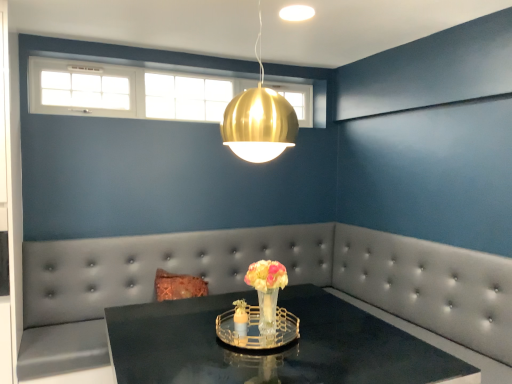
What is the approximate width of white glass window at upper center?

It is 11.47 centimeters.

The image size is (512, 384). I want to click on translucent glass vase at center, so click(x=267, y=290).

Is white glass window at upper center completely or partially inside gold metallic sphere at upper center?

No, white glass window at upper center is not inside gold metallic sphere at upper center.

From a real-world perspective, is gold metallic sphere at upper center positioned over white glass window at upper center based on gravity?

No, from a real-world perspective, gold metallic sphere at upper center is not on top of white glass window at upper center.

From the picture: From the image's perspective, which is above, gold metallic sphere at upper center or white glass window at upper center?

white glass window at upper center.

Which object is closer to the camera taking this photo, gold metallic sphere at upper center or white glass window at upper center?

gold metallic sphere at upper center is in front.

Does translucent glass vase at center have a greater width compared to tufted leather couch at center?

In fact, translucent glass vase at center might be narrower than tufted leather couch at center.

Is translucent glass vase at center facing towards tufted leather couch at center?

No, translucent glass vase at center is not turned towards tufted leather couch at center.

Which is nearer, (264, 296) or (99, 246)?

The point (264, 296) is more forward.

Is tufted leather couch at center wider than shiny black table at center?

No.

Which point is more distant from viewer, (428, 296) or (362, 325)?

The point (428, 296) is more distant.

Looking at the image, does tufted leather couch at center seem bigger or smaller compared to shiny black table at center?

Considering their sizes, tufted leather couch at center takes up less space than shiny black table at center.

Where is `table that is in front of the tufted leather couch at center`? table that is in front of the tufted leather couch at center is located at coordinates (272, 349).

Image resolution: width=512 pixels, height=384 pixels. Find the location of `lamp in front of the white glass window at upper center`. lamp in front of the white glass window at upper center is located at coordinates (259, 119).

From the image's perspective, is white glass window at upper center over gold metallic sphere at upper center?

Yes, from the image's perspective, white glass window at upper center is above gold metallic sphere at upper center.

Is white glass window at upper center in contact with gold metallic sphere at upper center?

white glass window at upper center and gold metallic sphere at upper center are not in contact.

Is white glass window at upper center closer to the viewer compared to gold metallic sphere at upper center?

No, it is behind gold metallic sphere at upper center.

From a real-world perspective, which object stands above the other?

gold metallic sphere at upper center.

What are the coordinates of `couch below the gold metallic sphere at upper center (from a real-world perspective)` in the screenshot? It's located at click(x=247, y=288).

Is tufted leather couch at center positioned with its back to gold metallic sphere at upper center?

That's not correct — tufted leather couch at center is not looking away from gold metallic sphere at upper center.

Is tufted leather couch at center bigger or smaller than gold metallic sphere at upper center?

tufted leather couch at center is bigger than gold metallic sphere at upper center.

Between translucent glass vase at center and white glass window at upper center, which one is positioned behind?

white glass window at upper center is more distant.

Between translucent glass vase at center and white glass window at upper center, which one appears on the left side from the viewer's perspective?

Positioned to the left is white glass window at upper center.

From the image's perspective, which is below, translucent glass vase at center or white glass window at upper center?

translucent glass vase at center.

Image resolution: width=512 pixels, height=384 pixels. In order to click on window that appears above the translucent glass vase at center (from a real-world perspective) in this screenshot , I will do `click(128, 91)`.

In the image, is white glass window at upper center on the left side or the right side of tufted leather couch at center?

In the image, white glass window at upper center appears on the left side of tufted leather couch at center.

Is white glass window at upper center positioned with its back to tufted leather couch at center?

white glass window at upper center does not have its back to tufted leather couch at center.

Consider the image. From the image's perspective, would you say white glass window at upper center is positioned over tufted leather couch at center?

Yes.

Would you say white glass window at upper center is a long distance from tufted leather couch at center?

Indeed, white glass window at upper center is not near tufted leather couch at center.

This screenshot has height=384, width=512. What are the coordinates of `window lying above the gold metallic sphere at upper center (from the image's perspective)` in the screenshot? It's located at click(128, 91).

You are a GUI agent. You are given a task and a screenshot of the screen. Output one action in this format:
    pyautogui.click(x=<x>, y=<y>)
    Task: Click on the floral arrangement on the right of tufted leather couch at center
    The height and width of the screenshot is (384, 512).
    Given the screenshot: What is the action you would take?
    pyautogui.click(x=267, y=290)

Based on the photo, when comparing their distances from gold metallic sphere at upper center, does tufted leather couch at center or white glass window at upper center seem further?

white glass window at upper center.

From the image, which object appears to be farther from white glass window at upper center, gold metallic sphere at upper center or shiny black table at center?

shiny black table at center lies further to white glass window at upper center than the other object.

Which object lies nearer to the anchor point white glass window at upper center, tufted leather couch at center or gold metallic sphere at upper center?

tufted leather couch at center is positioned closer to the anchor white glass window at upper center.

Which object lies nearer to the anchor point gold metallic sphere at upper center, translucent glass vase at center or white glass window at upper center?

translucent glass vase at center is closer to gold metallic sphere at upper center.

Based on their spatial positions, is shiny black table at center or gold metallic sphere at upper center closer to white glass window at upper center?

gold metallic sphere at upper center is positioned closer to the anchor white glass window at upper center.

Considering their positions, is shiny black table at center positioned closer to gold metallic sphere at upper center than white glass window at upper center?

Among the two, shiny black table at center is located nearer to gold metallic sphere at upper center.

Considering their positions, is translucent glass vase at center positioned further to shiny black table at center than white glass window at upper center?

white glass window at upper center lies further to shiny black table at center than the other object.

Which object lies further to the anchor point shiny black table at center, gold metallic sphere at upper center or translucent glass vase at center?

Among the two, gold metallic sphere at upper center is located further to shiny black table at center.

Find the location of `lamp between white glass window at upper center and tufted leather couch at center from top to bottom`. lamp between white glass window at upper center and tufted leather couch at center from top to bottom is located at coordinates (259, 119).

Where is `floral arrangement between gold metallic sphere at upper center and tufted leather couch at center vertically`? floral arrangement between gold metallic sphere at upper center and tufted leather couch at center vertically is located at coordinates (267, 290).

Locate an element on the screen. The image size is (512, 384). couch between white glass window at upper center and shiny black table at center in the vertical direction is located at coordinates (247, 288).

This screenshot has height=384, width=512. In order to click on floral arrangement between shiny black table at center and tufted leather couch at center in the front-back direction in this screenshot , I will do `click(267, 290)`.